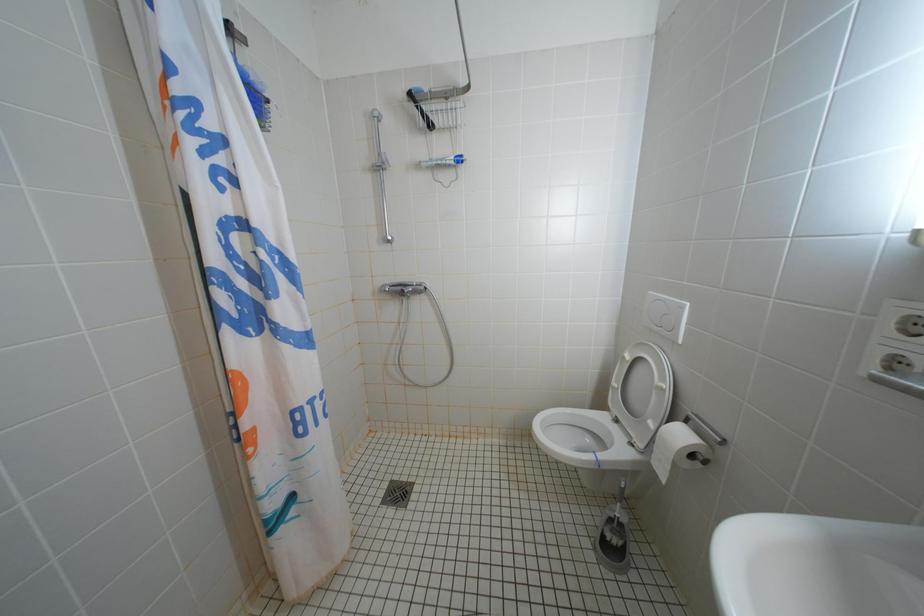
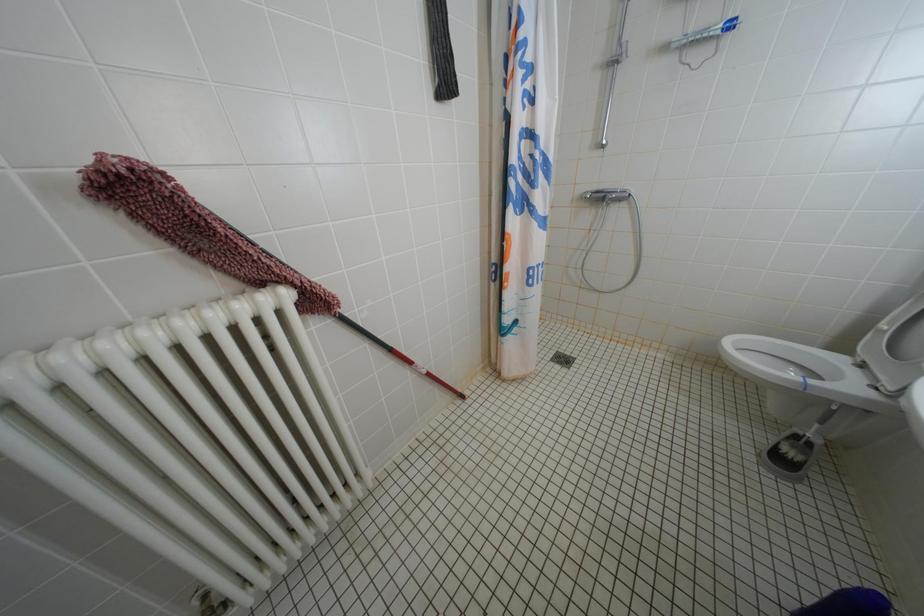
How did the camera likely rotate?

The camera's rotation is toward left-down.